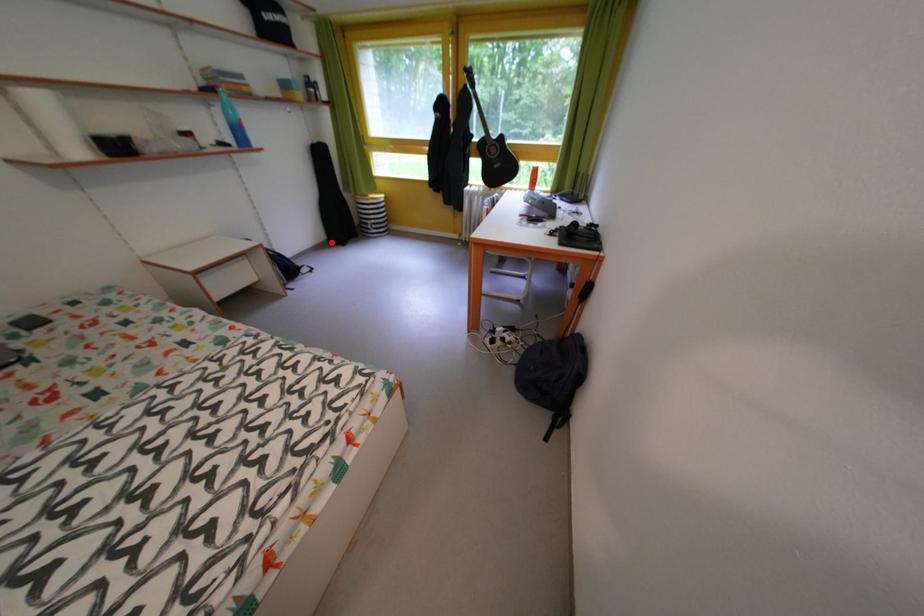
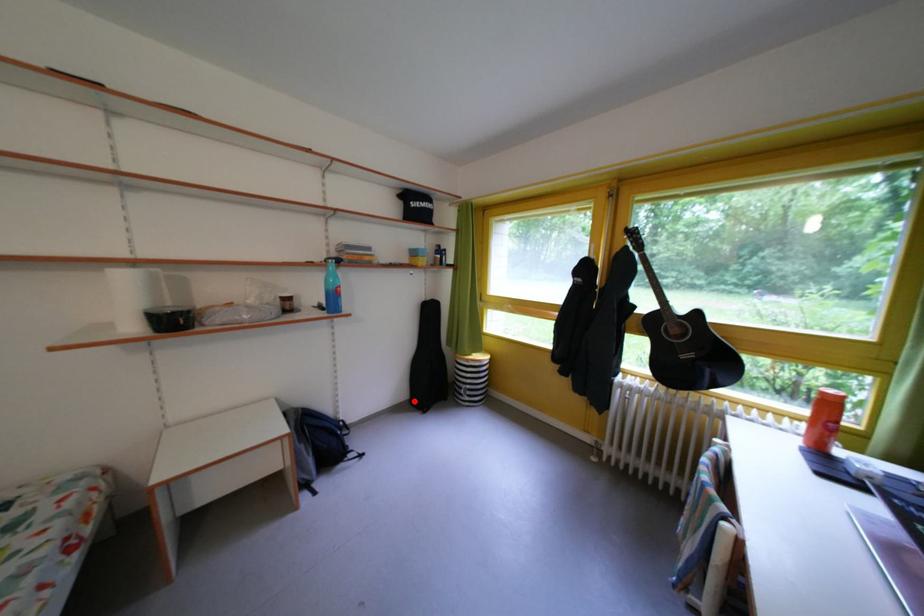
I am providing you with two images of the same scene from different viewpoints. A red point is marked on the first image and another point is marked on the second image. Is the marked point in image1 the same physical position as the marked point in image2?

Yes